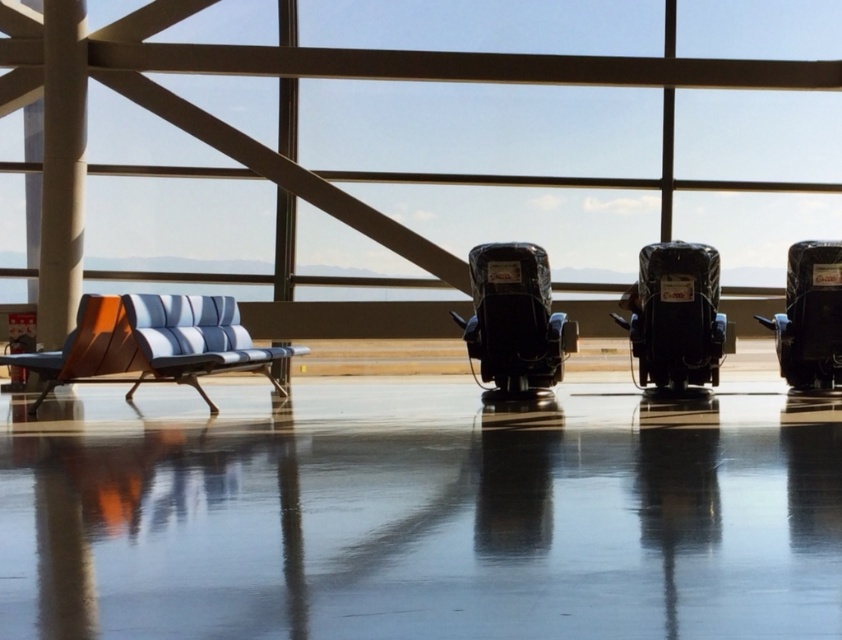
Question: Which object is positioned closest to the black plastic beach chair at right?

Choices:
 (A) wooden beach chair at left
 (B) matte black beach chair at center
 (C) blue striped fabric bench at left
 (D) black plastic baby carriage at center

Answer: (B)

Question: Can you confirm if blue striped fabric bench at left is positioned above wooden beach chair at left?

Choices:
 (A) yes
 (B) no

Answer: (A)

Question: Does matte black beach chair at center appear over black plastic beach chair at right?

Choices:
 (A) no
 (B) yes

Answer: (B)

Question: Estimate the real-world distances between objects in this image. Which object is farther from the black plastic beach chair at right?

Choices:
 (A) black plastic baby carriage at center
 (B) wooden beach chair at left
 (C) blue striped fabric bench at left

Answer: (B)

Question: Does matte black beach chair at center have a greater width compared to wooden beach chair at left?

Choices:
 (A) no
 (B) yes

Answer: (A)

Question: Which point is closer to the camera taking this photo?

Choices:
 (A) (36, 355)
 (B) (829, 352)
 (C) (515, 308)
 (D) (622, 296)

Answer: (A)